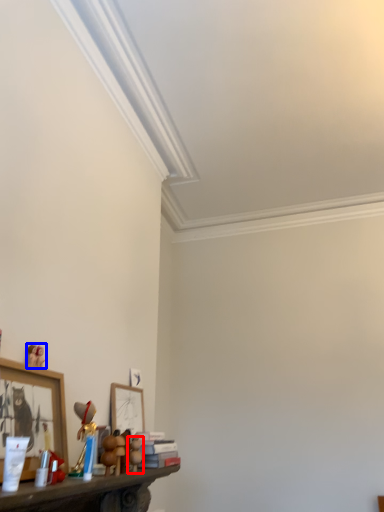
Question: Which point is further to the camera, toy (highlighted by a red box) or toy (highlighted by a blue box)?

Choices:
 (A) toy
 (B) toy

Answer: (A)